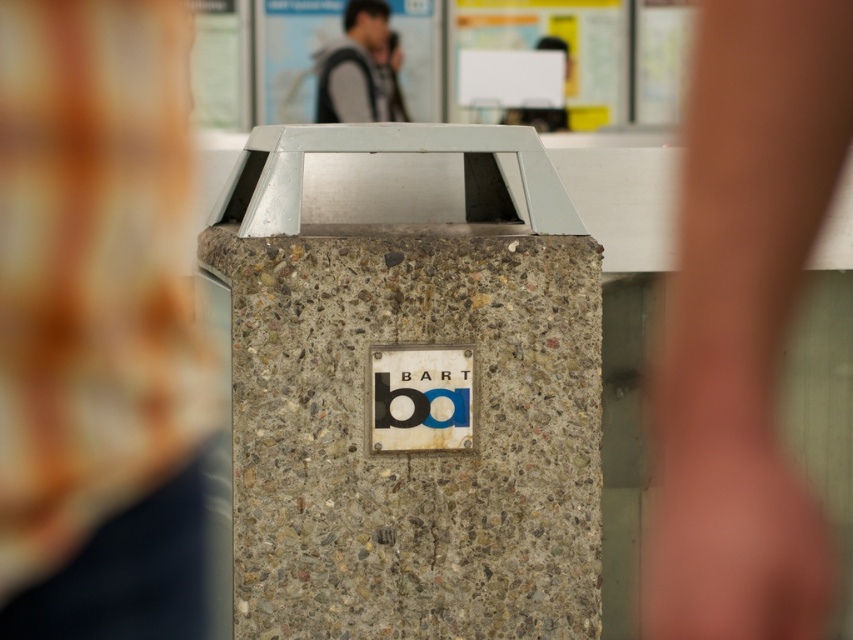
Can you confirm if gray fabric jacket at upper center is bigger than blue concrete sign at center?

Yes, gray fabric jacket at upper center is bigger than blue concrete sign at center.

Can you confirm if gray fabric jacket at upper center is thinner than blue concrete sign at center?

In fact, gray fabric jacket at upper center might be wider than blue concrete sign at center.

Where is `gray fabric jacket at upper center`? This screenshot has width=853, height=640. gray fabric jacket at upper center is located at coordinates (352, 67).

Does point (525, 250) come behind point (433, 397)?

Yes, it is behind point (433, 397).

Who is lower down, concrete textured pillar at center or blue concrete sign at center?

blue concrete sign at center

Does point (341, 230) come closer to viewer compared to point (399, 424)?

No, it is behind (399, 424).

Find the location of a particular element. concrete textured pillar at center is located at coordinates (409, 385).

Can you confirm if concrete textured pillar at center is positioned to the left of gray fabric jacket at upper center?

Incorrect, concrete textured pillar at center is not on the left side of gray fabric jacket at upper center.

Looking at this image, which is above, concrete textured pillar at center or gray fabric jacket at upper center?

gray fabric jacket at upper center is higher up.

Between point (468, 365) and point (358, 52), which one is positioned behind?

Point (358, 52)

Image resolution: width=853 pixels, height=640 pixels. In order to click on concrete textured pillar at center in this screenshot , I will do `click(409, 385)`.